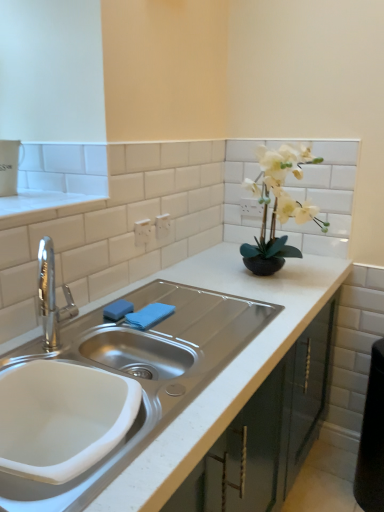
Question: Is blue fabric towel at sink outside of white matte countertop at center?

Choices:
 (A) no
 (B) yes

Answer: (A)

Question: From a real-world perspective, is blue fabric towel at sink under white matte countertop at center?

Choices:
 (A) yes
 (B) no

Answer: (A)

Question: Does blue fabric towel at sink have a larger size compared to white matte countertop at center?

Choices:
 (A) no
 (B) yes

Answer: (A)

Question: Is blue fabric towel at sink taller than white matte countertop at center?

Choices:
 (A) no
 (B) yes

Answer: (A)

Question: Would you say white matte countertop at center is part of blue fabric towel at sink's contents?

Choices:
 (A) yes
 (B) no

Answer: (B)

Question: Is white ceramic sink at lower left spatially inside white matte countertop at center, or outside of it?

Choices:
 (A) inside
 (B) outside

Answer: (A)

Question: Considering their positions, is white ceramic sink at lower left located in front of or behind white matte countertop at center?

Choices:
 (A) front
 (B) behind

Answer: (B)

Question: Is white ceramic sink at lower left bigger or smaller than white matte countertop at center?

Choices:
 (A) big
 (B) small

Answer: (B)

Question: Is white ceramic sink at lower left taller or shorter than white matte countertop at center?

Choices:
 (A) tall
 (B) short

Answer: (B)

Question: Is white matte countertop at center in front of or behind white ceramic sink at lower left in the image?

Choices:
 (A) behind
 (B) front

Answer: (B)

Question: Visually, is white matte countertop at center positioned to the left or to the right of white ceramic sink at lower left?

Choices:
 (A) right
 (B) left

Answer: (A)

Question: Is white matte countertop at center bigger or smaller than white ceramic sink at lower left?

Choices:
 (A) big
 (B) small

Answer: (A)

Question: From the image's perspective, is white matte countertop at center located above or below white ceramic sink at lower left?

Choices:
 (A) below
 (B) above

Answer: (B)

Question: In terms of height, does white matte countertop at center look taller or shorter compared to blue sponge at sink?

Choices:
 (A) short
 (B) tall

Answer: (B)

Question: Relative to blue sponge at sink, is white matte countertop at center in front or behind?

Choices:
 (A) front
 (B) behind

Answer: (A)